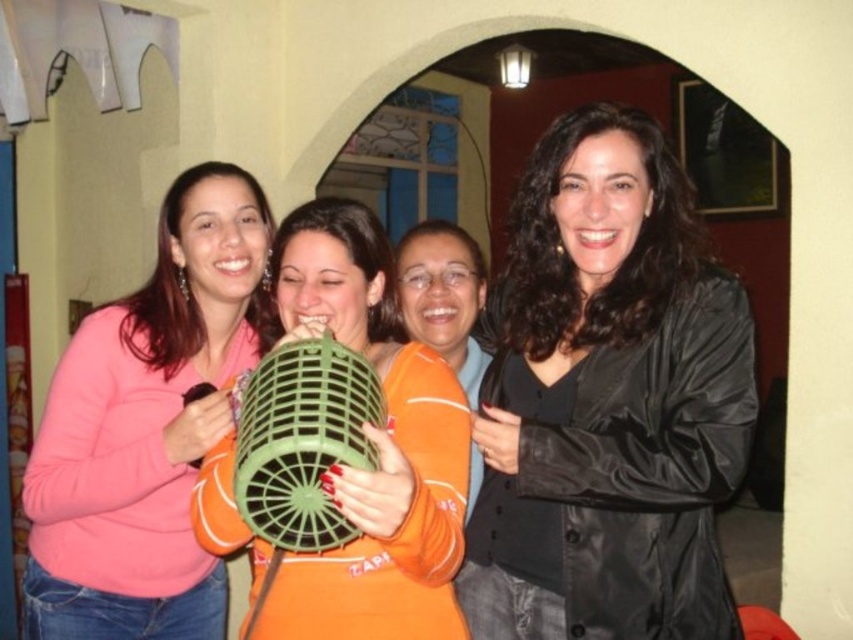
Is pink matte sweater at left thinner than green matte fan at center?

No.

Which is below, pink matte sweater at left or green matte fan at center?

Positioned lower is pink matte sweater at left.

You are a GUI agent. You are given a task and a screenshot of the screen. Output one action in this format:
    pyautogui.click(x=<x>, y=<y>)
    Task: Click on the pink matte sweater at left
    Image resolution: width=853 pixels, height=640 pixels.
    Given the screenshot: What is the action you would take?
    pyautogui.click(x=146, y=428)

At what (x,y) coordinates should I click in order to perform the action: click on pink matte sweater at left. Please return your answer as a coordinate pair (x, y). This screenshot has width=853, height=640. Looking at the image, I should click on (146, 428).

Does black shiny jacket at center appear on the left side of green matte fan at center?

In fact, black shiny jacket at center is to the right of green matte fan at center.

Based on the photo, who is positioned more to the left, black shiny jacket at center or green matte fan at center?

green matte fan at center

Between point (512, 544) and point (277, 268), which one is positioned in front?

Point (512, 544)

At what (x,y) coordinates should I click in order to perform the action: click on black shiny jacket at center. Please return your answer as a coordinate pair (x, y). The width and height of the screenshot is (853, 640). Looking at the image, I should click on (608, 401).

Is the position of green matte fan at center more distant than that of orange fabric pillow at center?

No, it is not.

Can you confirm if green matte fan at center is positioned to the left of orange fabric pillow at center?

Correct, you'll find green matte fan at center to the left of orange fabric pillow at center.

Which is in front, point (425, 445) or point (437, 330)?

Positioned in front is point (425, 445).

Where is `green matte fan at center`? This screenshot has width=853, height=640. green matte fan at center is located at coordinates (374, 445).